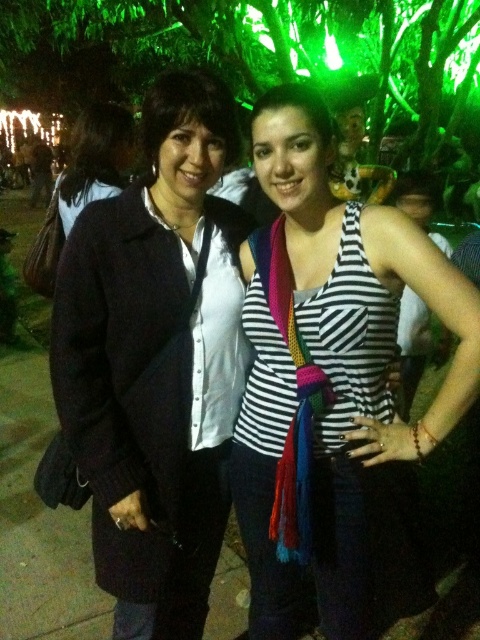
Based on the photo, is striped fabric tank top at center below matte black sweater at left?

Correct, striped fabric tank top at center is located below matte black sweater at left.

Who is positioned more to the right, striped fabric tank top at center or matte black sweater at left?

striped fabric tank top at center

Does point (343, 276) come closer to viewer compared to point (84, 390)?

That is True.

Find the location of a particular element. The height and width of the screenshot is (640, 480). striped fabric tank top at center is located at coordinates (333, 385).

From the picture: Does matte black sweater at left appear over dark blue sweater at left?

Actually, matte black sweater at left is below dark blue sweater at left.

You are a GUI agent. You are given a task and a screenshot of the screen. Output one action in this format:
    pyautogui.click(x=<x>, y=<y>)
    Task: Click on the matte black sweater at left
    Image resolution: width=480 pixels, height=640 pixels.
    Given the screenshot: What is the action you would take?
    pyautogui.click(x=156, y=360)

Locate an element on the screen. striped fabric tank top at center is located at coordinates (333, 385).

Is striped fabric tank top at center further to the viewer compared to dark blue sweater at left?

That is False.

What do you see at coordinates (333, 385) in the screenshot?
I see `striped fabric tank top at center` at bounding box center [333, 385].

Image resolution: width=480 pixels, height=640 pixels. Identify the location of striped fabric tank top at center. (333, 385).